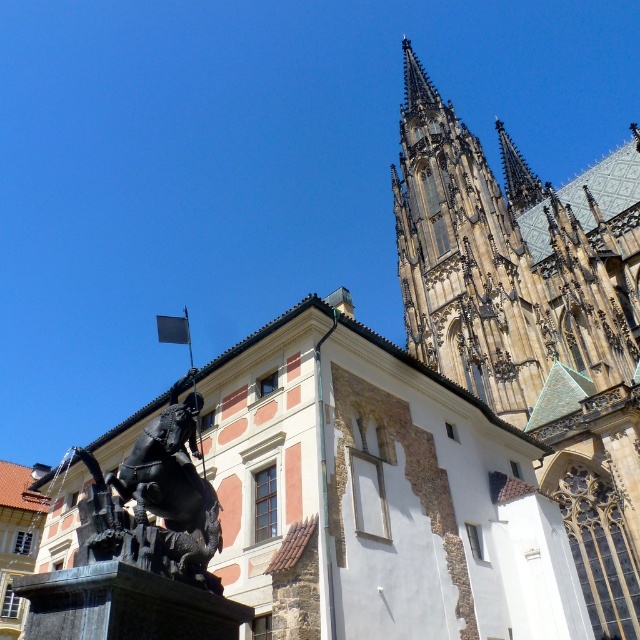
Consider the image. You are an architect analyzing the cathedral in the image. You notice two golden stone structures at the upper center of the cathedral. Which one is taller between the golden stone tower at upper center and the golden stone spire at upper center?

The golden stone tower at upper center is taller than the golden stone spire at upper center according to the description.

You are a photographer planning to capture the grandeur of the cathedral and the statue. You want to ensure both the golden stone spire at upper center and the polished bronze statue at center are clearly visible in the frame. Based on their heights, which one should you focus on first to ensure both are in the shot?

The golden stone spire at upper center is taller than the polished bronze statue at center, so focusing on the spire first will help ensure both are in the frame as the statue will naturally be within the same vertical plane.

Consider the image. You are standing at the base of the cathedral and want to take a photo of the golden stone tower at upper center. According to the scene description, where should you aim your camera to capture it perfectly?

The golden stone tower at upper center is located at point 0.498 on the horizontal axis and 0.834 on the vertical axis, so you should aim your camera towards the center of the upper part of the cathedral to capture it perfectly.